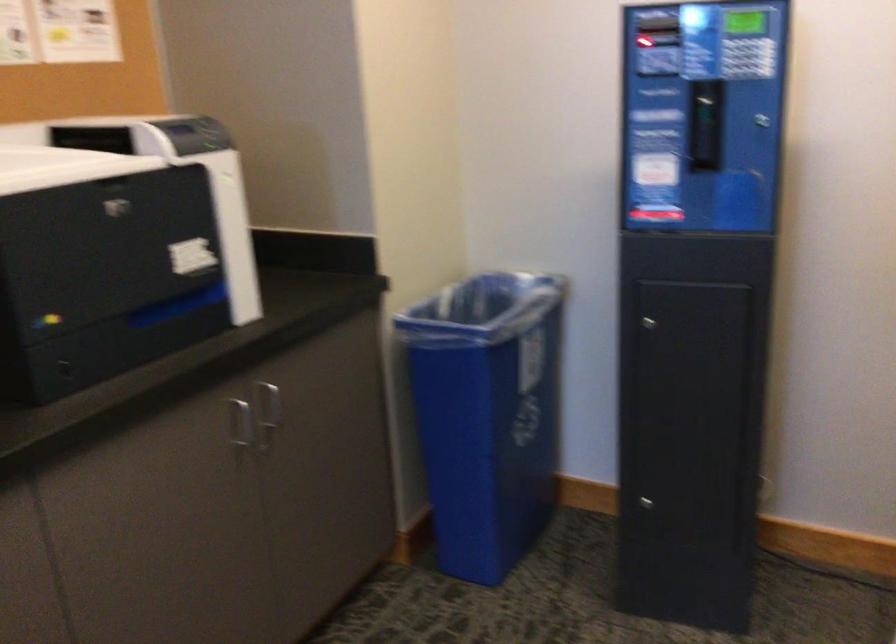
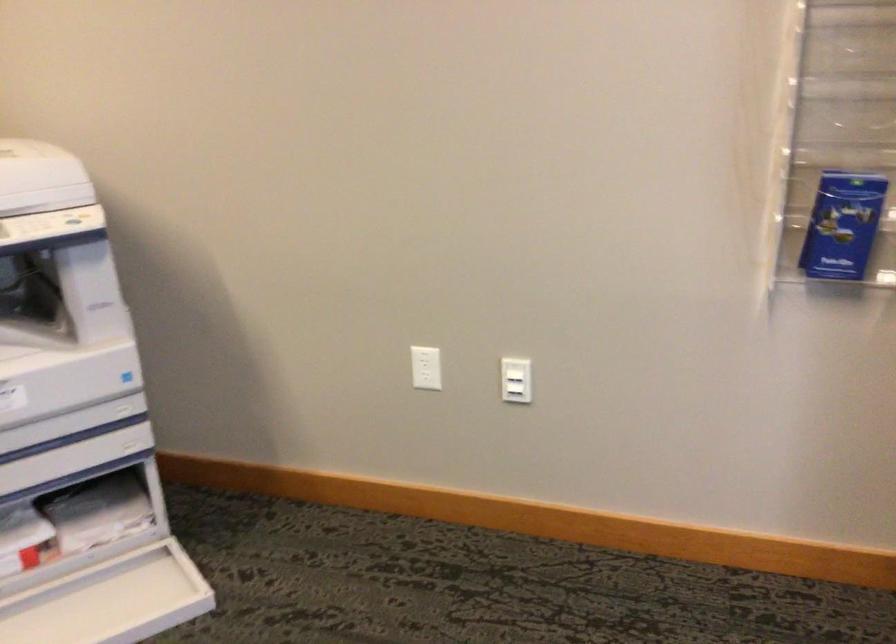
First-person continuous shooting, in which direction is the camera rotating?

The rotation direction of the camera is right-down.